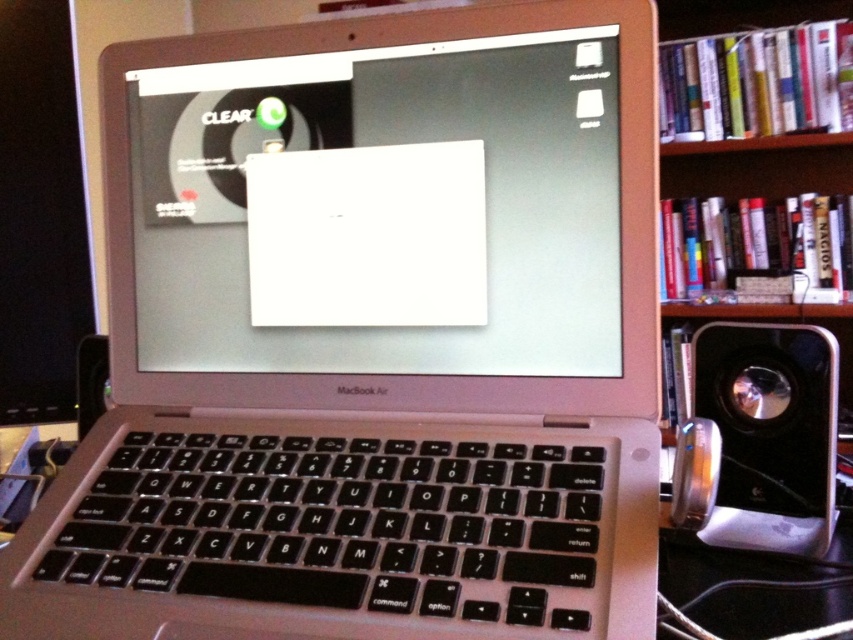
Question: From the image, what is the correct spatial relationship of wooden bookshelf at right in relation to black plastic speaker at lower right?

Choices:
 (A) below
 (B) above

Answer: (B)

Question: Which point appears closest to the camera in this image?

Choices:
 (A) (683, 147)
 (B) (747, 442)
 (C) (88, 381)
 (D) (190, 241)

Answer: (B)

Question: Which of these objects is positioned closest to the metallic silver speaker at lower left?

Choices:
 (A) white matte paper at center
 (B) black plastic speaker at lower right

Answer: (A)

Question: Is wooden bookshelf at right wider than metallic silver speaker at lower left?

Choices:
 (A) no
 (B) yes

Answer: (B)

Question: Is white matte paper at center wider than metallic silver speaker at lower left?

Choices:
 (A) no
 (B) yes

Answer: (B)

Question: Which point appears farthest from the camera in this image?

Choices:
 (A) (701, 397)
 (B) (77, 369)
 (C) (521, 269)

Answer: (B)